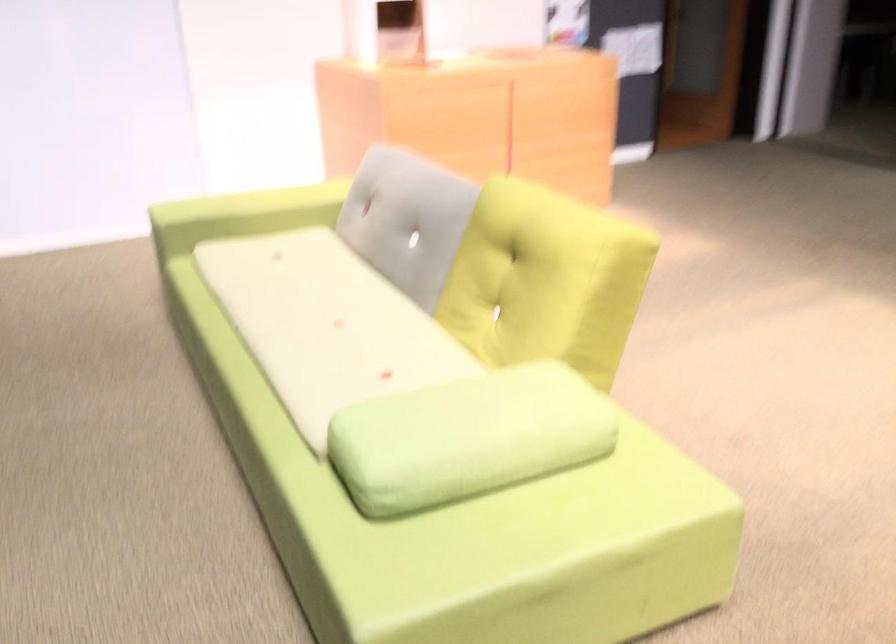
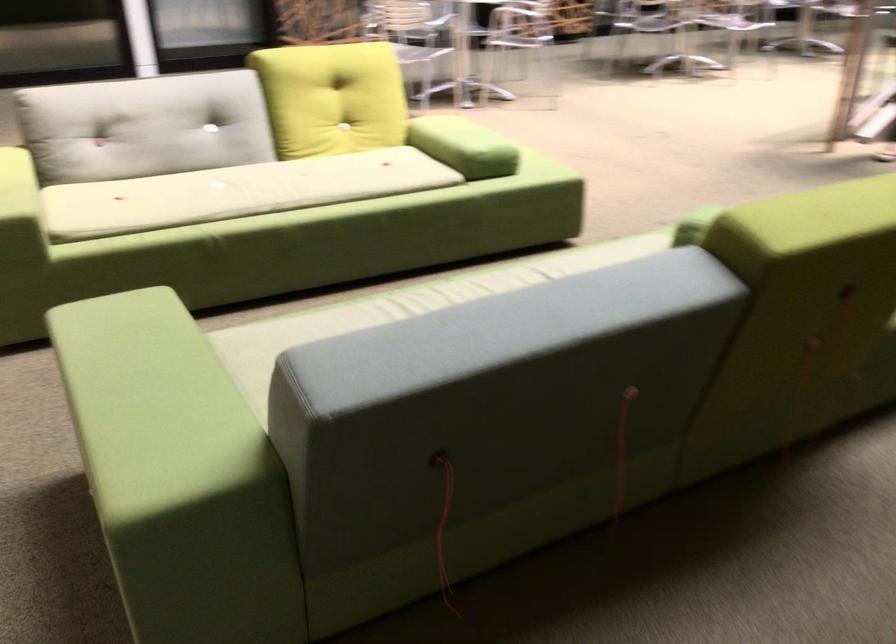
Where in the second image is the point corresponding to the point at 152,210 from the first image?

(19, 207)